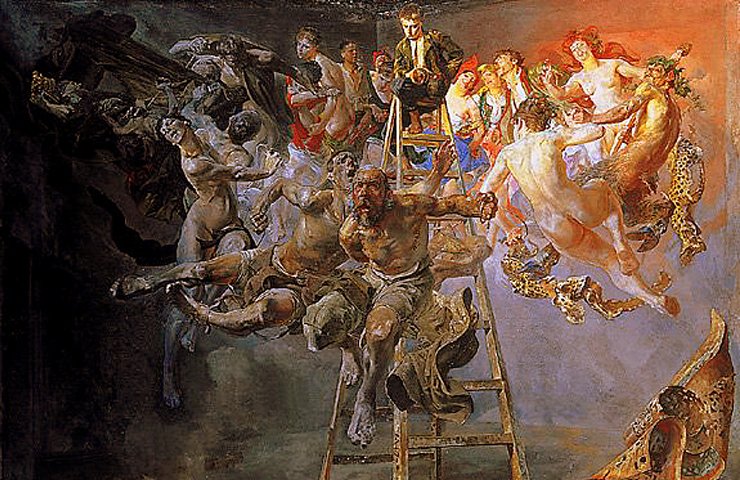
Where is `painting`? The width and height of the screenshot is (740, 480). painting is located at coordinates (397, 148).